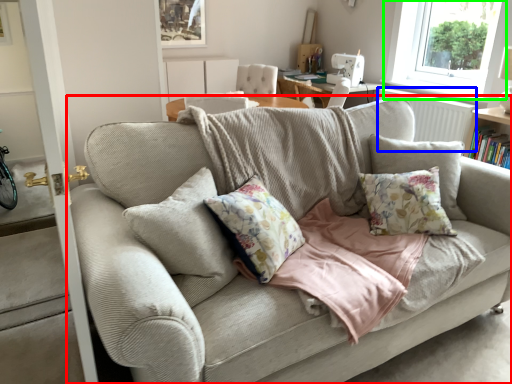
Question: Which object is positioned farthest from studio couch (highlighted by a red box)? Select from radiator (highlighted by a blue box) and window (highlighted by a green box).

Choices:
 (A) radiator
 (B) window

Answer: (B)